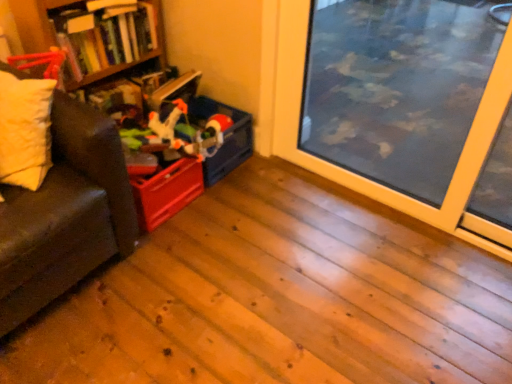
Question: Can you confirm if wooden bookshelf at upper left is positioned to the right of soft yellow pillow at left?

Choices:
 (A) no
 (B) yes

Answer: (B)

Question: Considering the relative sizes of wooden bookshelf at upper left and soft yellow pillow at left in the image provided, is wooden bookshelf at upper left taller than soft yellow pillow at left?

Choices:
 (A) yes
 (B) no

Answer: (B)

Question: Does wooden bookshelf at upper left have a lesser width compared to soft yellow pillow at left?

Choices:
 (A) yes
 (B) no

Answer: (B)

Question: Considering the relative sizes of wooden bookshelf at upper left and soft yellow pillow at left in the image provided, is wooden bookshelf at upper left smaller than soft yellow pillow at left?

Choices:
 (A) no
 (B) yes

Answer: (A)

Question: Considering the relative sizes of wooden bookshelf at upper left and soft yellow pillow at left in the image provided, is wooden bookshelf at upper left bigger than soft yellow pillow at left?

Choices:
 (A) yes
 (B) no

Answer: (A)

Question: Could soft yellow pillow at left be considered to be inside wooden bookshelf at upper left?

Choices:
 (A) no
 (B) yes

Answer: (A)

Question: Is soft yellow pillow at left positioned with its back to transparent glass window screen at center right?

Choices:
 (A) yes
 (B) no

Answer: (B)

Question: Can you see soft yellow pillow at left touching transparent glass window screen at center right?

Choices:
 (A) no
 (B) yes

Answer: (A)

Question: Considering the relative sizes of soft yellow pillow at left and transparent glass window screen at center right in the image provided, is soft yellow pillow at left shorter than transparent glass window screen at center right?

Choices:
 (A) no
 (B) yes

Answer: (B)

Question: Does soft yellow pillow at left lie in front of transparent glass window screen at center right?

Choices:
 (A) yes
 (B) no

Answer: (A)

Question: From a real-world perspective, is soft yellow pillow at left located beneath transparent glass window screen at center right?

Choices:
 (A) yes
 (B) no

Answer: (B)

Question: Is soft yellow pillow at left thinner than transparent glass window screen at center right?

Choices:
 (A) yes
 (B) no

Answer: (B)

Question: Considering the relative sizes of matte plastic storage box at center-left and wooden bookshelf at upper left in the image provided, is matte plastic storage box at center-left bigger than wooden bookshelf at upper left?

Choices:
 (A) no
 (B) yes

Answer: (A)